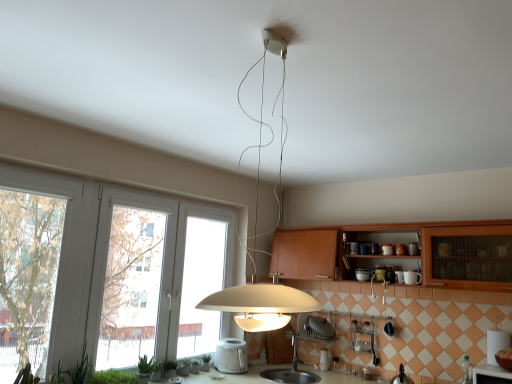
Question: Is white glossy toaster at center, which appears as the 1th appliance when viewed from the right, outside wooden cabinet at center?

Choices:
 (A) yes
 (B) no

Answer: (A)

Question: Is white glossy toaster at center, which appears as the 1th appliance when viewed from the right, positioned far away from wooden cabinet at center?

Choices:
 (A) no
 (B) yes

Answer: (B)

Question: Is white glossy toaster at center, which appears as the 1th appliance when viewed from the right, facing towards wooden cabinet at center?

Choices:
 (A) no
 (B) yes

Answer: (A)

Question: From the image's perspective, would you say white glossy toaster at center, the second appliance when ordered from left to right, is shown under wooden cabinet at center?

Choices:
 (A) yes
 (B) no

Answer: (A)

Question: Is white glossy toaster at center, the second appliance when ordered from left to right, turned away from wooden cabinet at center?

Choices:
 (A) no
 (B) yes

Answer: (A)

Question: In terms of size, does green leafy plant at lower left, arranged as the second plant when viewed from the front, appear bigger or smaller than white plastic toaster at center, the second appliance in the right-to-left sequence?

Choices:
 (A) small
 (B) big

Answer: (A)

Question: Would you say green leafy plant at lower left, arranged as the 5th plant when viewed from the back, is inside or outside white plastic toaster at center, the second appliance in the right-to-left sequence?

Choices:
 (A) inside
 (B) outside

Answer: (B)

Question: In the image, is green leafy plant at lower left, the 5th plant from the right, positioned in front of or behind white plastic toaster at center, the first appliance viewed from the left?

Choices:
 (A) behind
 (B) front

Answer: (B)

Question: Is green leafy plant at lower left, the 2th plant from the left, taller or shorter than white plastic toaster at center, the second appliance in the right-to-left sequence?

Choices:
 (A) tall
 (B) short

Answer: (A)

Question: From the image's perspective, relative to metallic silver faucet at lower center, is white glossy toaster at center, which appears as the 1th appliance when viewed from the right, above or below?

Choices:
 (A) above
 (B) below

Answer: (B)

Question: Choose the correct answer: Is white glossy toaster at center, which appears as the 1th appliance when viewed from the right, inside metallic silver faucet at lower center or outside it?

Choices:
 (A) inside
 (B) outside

Answer: (B)

Question: In the image, is white glossy toaster at center, which appears as the 1th appliance when viewed from the right, on the left side or the right side of metallic silver faucet at lower center?

Choices:
 (A) right
 (B) left

Answer: (A)

Question: In terms of size, does white glossy toaster at center, the second appliance when ordered from left to right, appear bigger or smaller than metallic silver faucet at lower center?

Choices:
 (A) big
 (B) small

Answer: (B)

Question: From the image's perspective, is white glossy toaster at center, which appears as the 1th appliance when viewed from the right, located above or below matte white pendant light at center?

Choices:
 (A) below
 (B) above

Answer: (A)

Question: Is point (318, 364) positioned closer to the camera than point (223, 299)?

Choices:
 (A) farther
 (B) closer

Answer: (A)